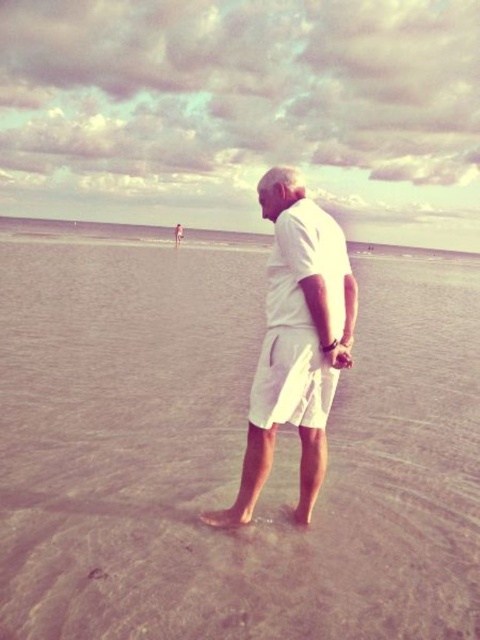
Is sandy beach at center in front of white cotton shorts at center?

Yes, it is in front of white cotton shorts at center.

Who is more distant from viewer, (441, 362) or (316, 342)?

The point (441, 362) is more distant.

Between point (408, 468) and point (215, 515), which one is positioned behind?

Positioned behind is point (408, 468).

This screenshot has height=640, width=480. Find the location of `sandy beach at center`. sandy beach at center is located at coordinates (228, 452).